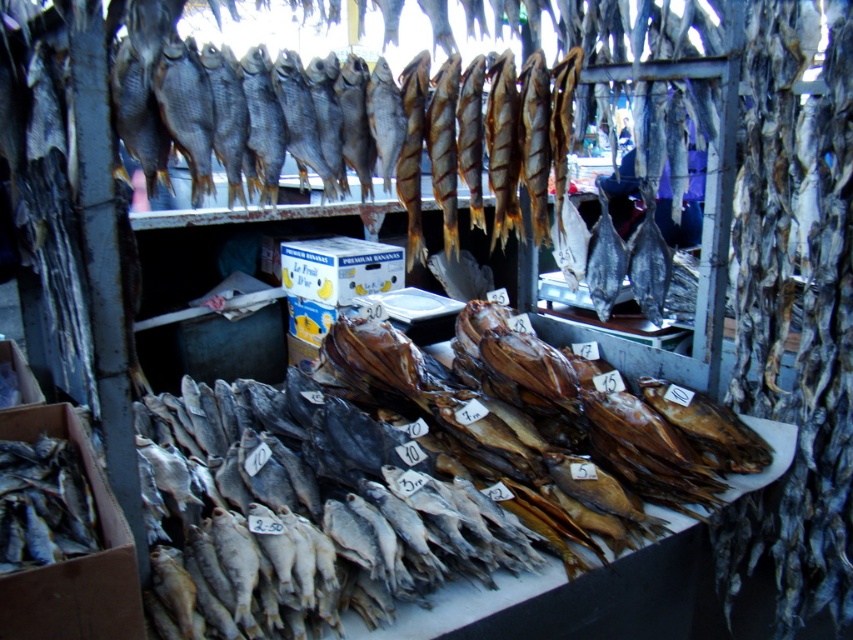
You are a customer at the fish market and want to locate the dark brown smoked fish at center. According to the coordinates provided, where exactly is it positioned?

The dark brown smoked fish at center is located at point (412, 476).

You are a customer at the fish market stall. You see two fish at the center of the stall, the dark brown smoked fish at center and the shiny silver fish at center. Which fish is positioned lower in the arrangement?

The dark brown smoked fish at center is located below the shiny silver fish at center, so it is positioned lower in the arrangement.

You are at the fish market stall and want to pick up an item located at point (305, 381) and another item at point (599, 243). Which item will you reach first if you move forward in a straight line?

The item at point (305, 381) is closer to you than point (599, 243), so you will reach it first.